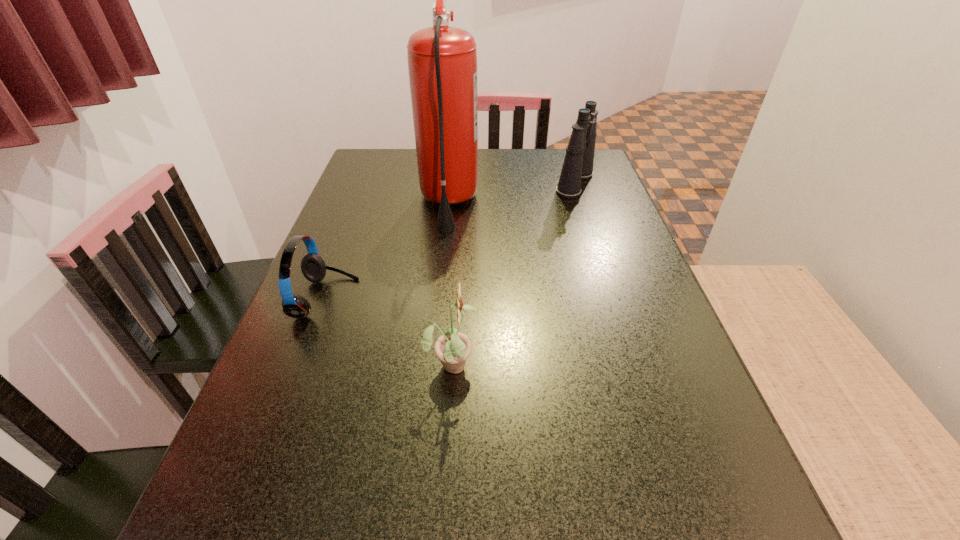
Find the location of a particular element. vacant point located 0.240m with the microphone attached to the side of the headset is located at coordinates (466, 299).

Locate an element on the screen. The height and width of the screenshot is (540, 960). fire extinguisher that is positioned at the far edge is located at coordinates (442, 61).

Where is `binoculars present at the far edge`? binoculars present at the far edge is located at coordinates (578, 163).

I want to click on object that is positioned at the left edge, so click(x=313, y=267).

The height and width of the screenshot is (540, 960). I want to click on object at the right edge, so click(x=578, y=163).

This screenshot has width=960, height=540. I want to click on object that is positioned at the far right corner, so click(x=578, y=163).

Identify the location of free space at the far edge of the desktop. (512, 183).

Identify the location of vacant area at the left edge of the desktop. (328, 241).

Locate an element on the screen. The height and width of the screenshot is (540, 960). blank space at the right edge of the desktop is located at coordinates (586, 295).

Find the location of a particular element. This screenshot has height=540, width=960. free space at the far left corner of the desktop is located at coordinates (391, 176).